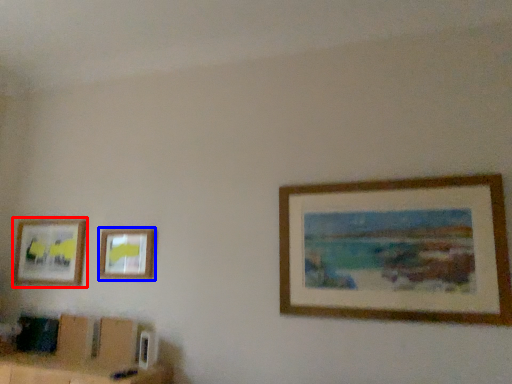
Question: Which object is closer to the camera taking this photo, picture frame (highlighted by a red box) or picture frame (highlighted by a blue box)?

Choices:
 (A) picture frame
 (B) picture frame

Answer: (B)